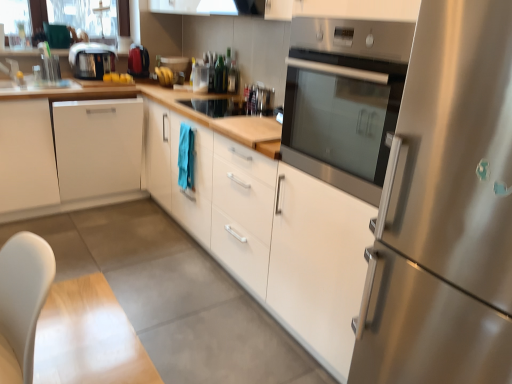
Question: Looking at the image, does satin black toaster at upper left seem bigger or smaller compared to clear glass jar at center, placed as the 1th appliance when sorted from right to left?

Choices:
 (A) small
 (B) big

Answer: (B)

Question: Is satin black toaster at upper left inside the boundaries of clear glass jar at center, placed as the 1th appliance when sorted from right to left, or outside?

Choices:
 (A) inside
 (B) outside

Answer: (B)

Question: Based on their relative distances, which object is nearer to the stainless steel refrigerator at right?

Choices:
 (A) satin black toaster at upper left
 (B) white matte cabinet at left, acting as the first cabinetry starting from the left
 (C) stainless steel oven at center
 (D) white matte cabinet at center, arranged as the first cabinetry when viewed from the right
 (E) clear glass jar at center, placed as the 1th appliance when sorted from right to left

Answer: (C)

Question: Considering the real-world distances, which object is farthest from the matte red toaster at upper left, the 1th appliance viewed from the left?

Choices:
 (A) stainless steel oven at center
 (B) white matte cabinet at center, placed as the second cabinetry when sorted from left to right
 (C) clear glass jar at center, placed as the second appliance when sorted from left to right
 (D) white matte cabinet at left, acting as the first cabinetry starting from the left
 (E) satin black toaster at upper left

Answer: (A)